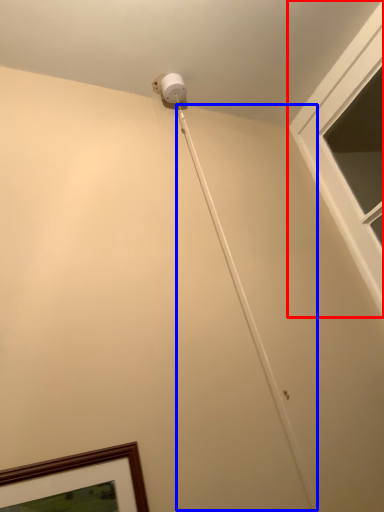
Question: Which object appears closest to the camera in this image, window (highlighted by a red box) or string (highlighted by a blue box)?

Choices:
 (A) window
 (B) string

Answer: (B)